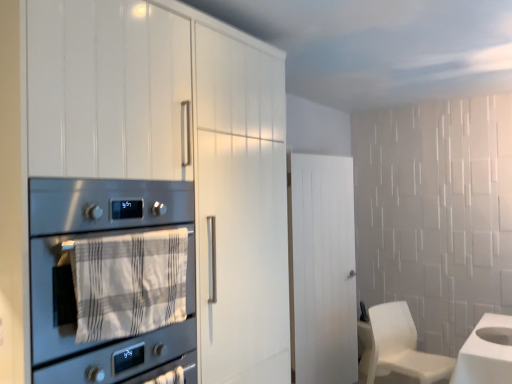
Question: Is white wood door at center directly adjacent to stainless steel oven at left?

Choices:
 (A) yes
 (B) no

Answer: (B)

Question: From the image's perspective, is white wood door at center located above stainless steel oven at left?

Choices:
 (A) yes
 (B) no

Answer: (B)

Question: Would you say white wood door at center contains stainless steel oven at left?

Choices:
 (A) yes
 (B) no

Answer: (B)

Question: Is white wood door at center facing away from stainless steel oven at left?

Choices:
 (A) yes
 (B) no

Answer: (B)

Question: Is white wood door at center closer to camera compared to stainless steel oven at left?

Choices:
 (A) no
 (B) yes

Answer: (A)

Question: From a real-world perspective, is white wood door at center beneath stainless steel oven at left?

Choices:
 (A) no
 (B) yes

Answer: (B)

Question: From the image's perspective, is white matte chair at lower right over white wood door at center?

Choices:
 (A) yes
 (B) no

Answer: (B)

Question: From a real-world perspective, is white matte chair at lower right located beneath white wood door at center?

Choices:
 (A) no
 (B) yes

Answer: (B)

Question: From the image's perspective, would you say white matte chair at lower right is shown under white wood door at center?

Choices:
 (A) no
 (B) yes

Answer: (B)

Question: Considering the relative sizes of white matte chair at lower right and white wood door at center in the image provided, is white matte chair at lower right taller than white wood door at center?

Choices:
 (A) no
 (B) yes

Answer: (A)

Question: Does white matte chair at lower right have a greater width compared to white wood door at center?

Choices:
 (A) yes
 (B) no

Answer: (A)

Question: Does white matte chair at lower right have a lesser width compared to white wood door at center?

Choices:
 (A) yes
 (B) no

Answer: (B)

Question: From the image's perspective, would you say stainless steel oven at left is positioned over white matte chair at lower right?

Choices:
 (A) yes
 (B) no

Answer: (A)